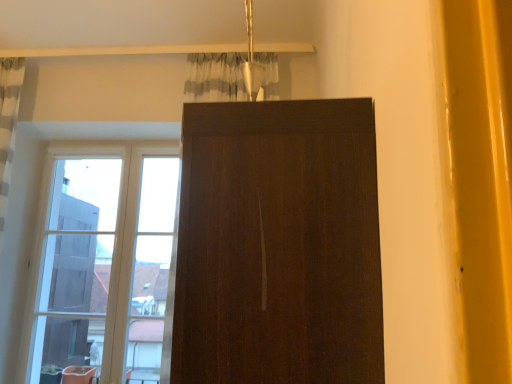
What do you see at coordinates (85, 258) in the screenshot? I see `clear glass window at left` at bounding box center [85, 258].

From the picture: In order to face clear glass window at left, should I rotate leftwards or rightwards?

Rotate your view left by about 23.257°.

Locate an element on the screen. The width and height of the screenshot is (512, 384). clear glass window at left is located at coordinates (85, 258).

Where is `clear glass window at left`? clear glass window at left is located at coordinates (85, 258).